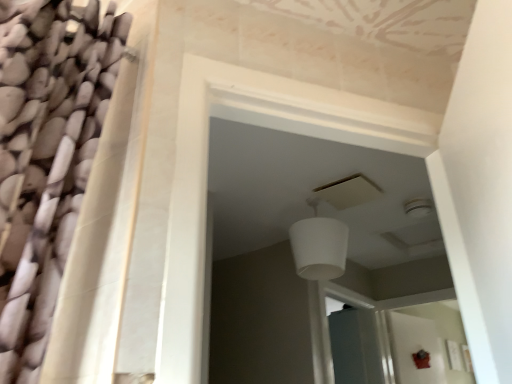
Question: Visually, is transparent glass screen door at center positioned to the left or to the right of white matte lampshade at center?

Choices:
 (A) right
 (B) left

Answer: (A)

Question: In terms of height, does transparent glass screen door at center look taller or shorter compared to white matte lampshade at center?

Choices:
 (A) short
 (B) tall

Answer: (B)

Question: From the image's perspective, is transparent glass screen door at center located above or below white matte lampshade at center?

Choices:
 (A) above
 (B) below

Answer: (B)

Question: In the image, is white matte lampshade at center positioned in front of or behind transparent glass screen door at center?

Choices:
 (A) behind
 (B) front

Answer: (B)

Question: Looking at their shapes, would you say white matte lampshade at center is wider or thinner than transparent glass screen door at center?

Choices:
 (A) thin
 (B) wide

Answer: (B)

Question: Would you say white matte lampshade at center is to the left or to the right of transparent glass screen door at center in the picture?

Choices:
 (A) left
 (B) right

Answer: (A)

Question: Considering the positions of white matte lampshade at center and transparent glass screen door at center in the image, is white matte lampshade at center taller or shorter than transparent glass screen door at center?

Choices:
 (A) tall
 (B) short

Answer: (B)